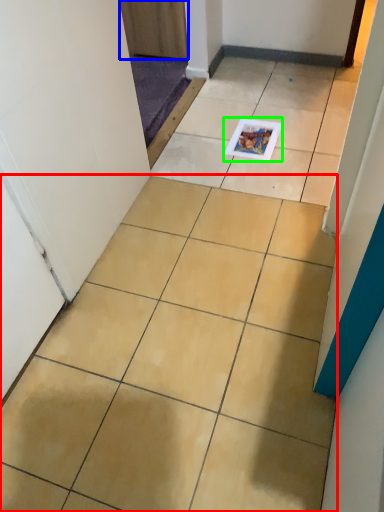
Question: Which object is positioned closest to ceramic tile (highlighted by a red box)? Select from door (highlighted by a blue box) and magazine (highlighted by a green box).

Choices:
 (A) door
 (B) magazine

Answer: (B)